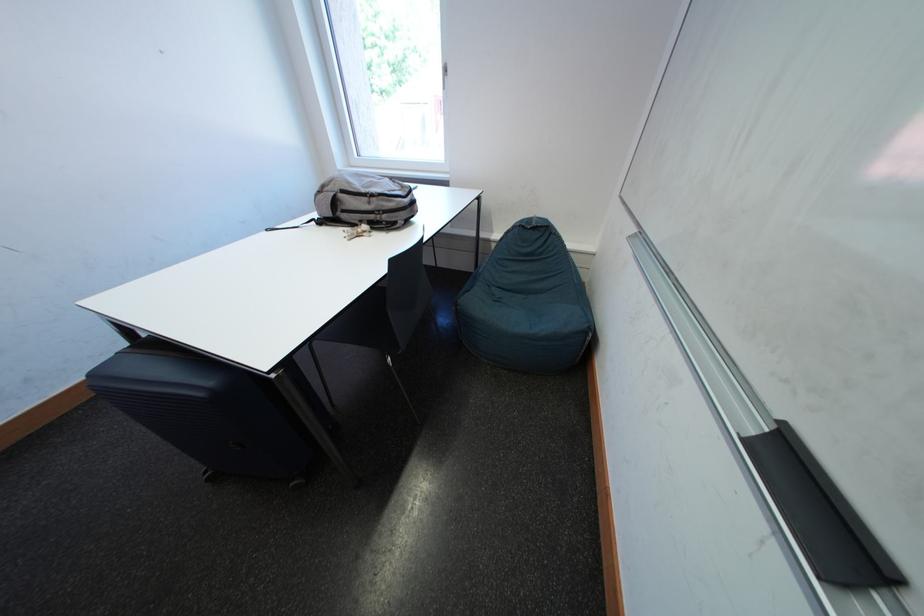
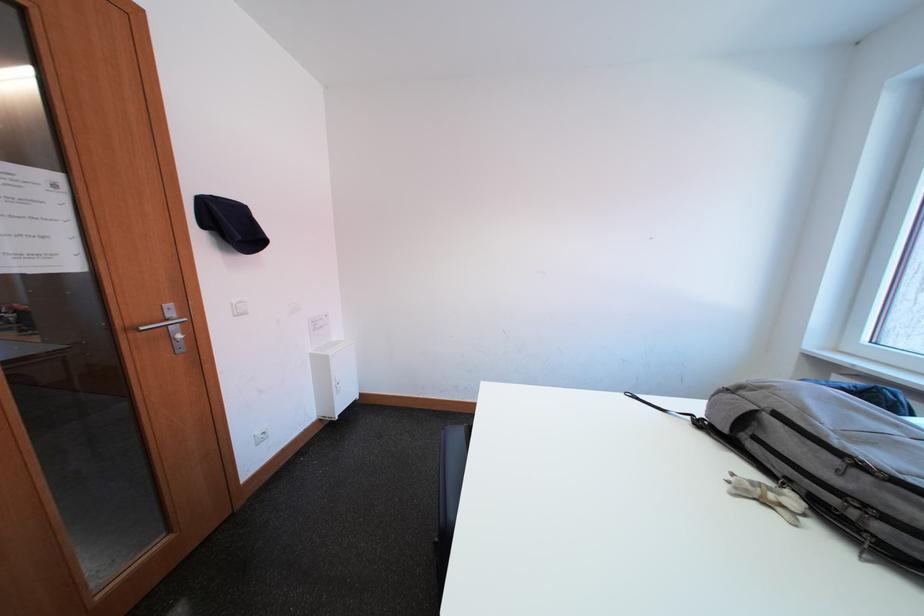
In the second image, find the point that corresponds to [335,228] in the first image.

(719, 438)